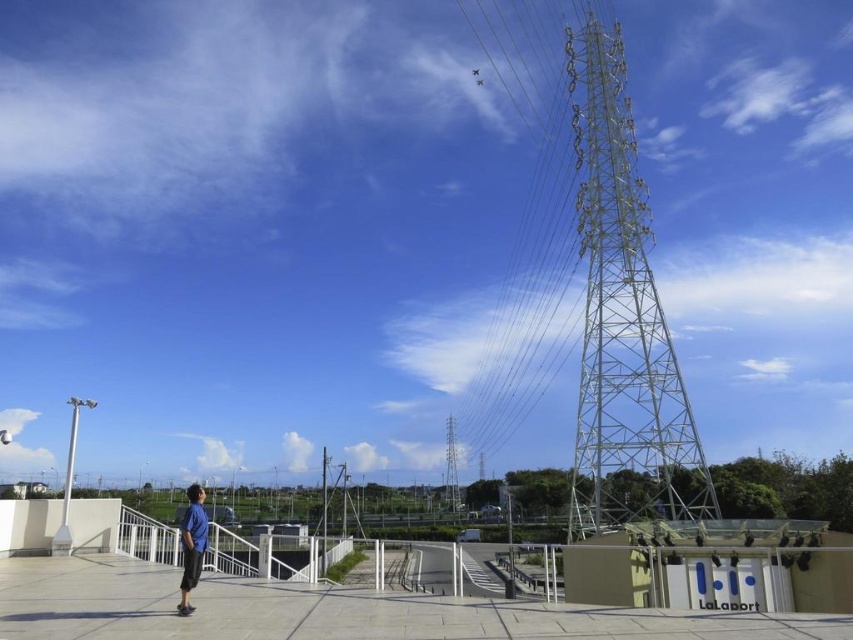
You are a photographer trying to capture the metallic silver tower at center without any obstructions. You notice the blue fabric shirt at lower left is blocking your view. Can you move to the right or left to avoid it?

The blue fabric shirt at lower left is in front of the metallic silver tower at center, so moving to the right or left might allow you to position yourself where the blue fabric shirt at lower left is no longer blocking the view of the metallic silver tower at center.

You are a photographer planning to take a photo of the metallic silver tower at right and the metallic silver tower at center. Based on their sizes, which tower should you focus on to ensure it appears more prominent in the final image?

The metallic silver tower at right is larger in size than the metallic silver tower at center, so focusing on the metallic silver tower at right will make it appear more prominent in the photo.